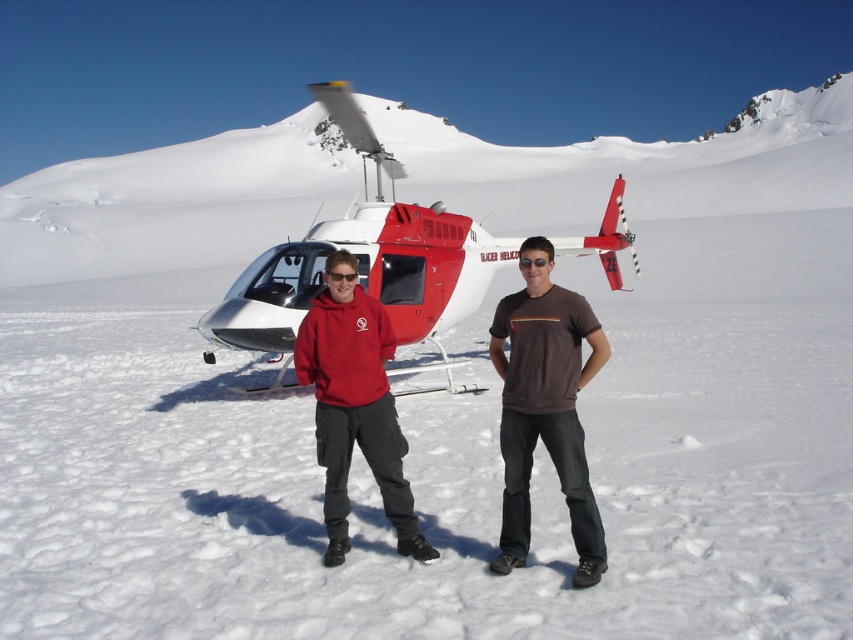
Can you confirm if matte red hoodie at center is shorter than shiny black goggles at center?

Incorrect, matte red hoodie at center's height does not fall short of shiny black goggles at center's.

Which is behind, point (315, 337) or point (326, 278)?

Positioned behind is point (326, 278).

Who is more forward, (374, 448) or (335, 278)?

Point (335, 278) is in front.

Identify the location of matte red hoodie at center. The image size is (853, 640). (355, 412).

Can you confirm if shiny black goggles at center is positioned above black matte sunglasses at center?

Actually, shiny black goggles at center is below black matte sunglasses at center.

Can you confirm if shiny black goggles at center is positioned to the right of black matte sunglasses at center?

In fact, shiny black goggles at center is to the left of black matte sunglasses at center.

Is point (345, 275) closer to viewer compared to point (544, 257)?

No.

Locate an element on the screen. Image resolution: width=853 pixels, height=640 pixels. shiny black goggles at center is located at coordinates (340, 275).

Who is positioned more to the right, red fleece hoodie at center or matte red hoodie at center?

Positioned to the right is red fleece hoodie at center.

Is red fleece hoodie at center further to camera compared to matte red hoodie at center?

That is False.

Does point (567, 358) lie in front of point (326, 442)?

Yes.

Identify the location of red fleece hoodie at center. (546, 413).